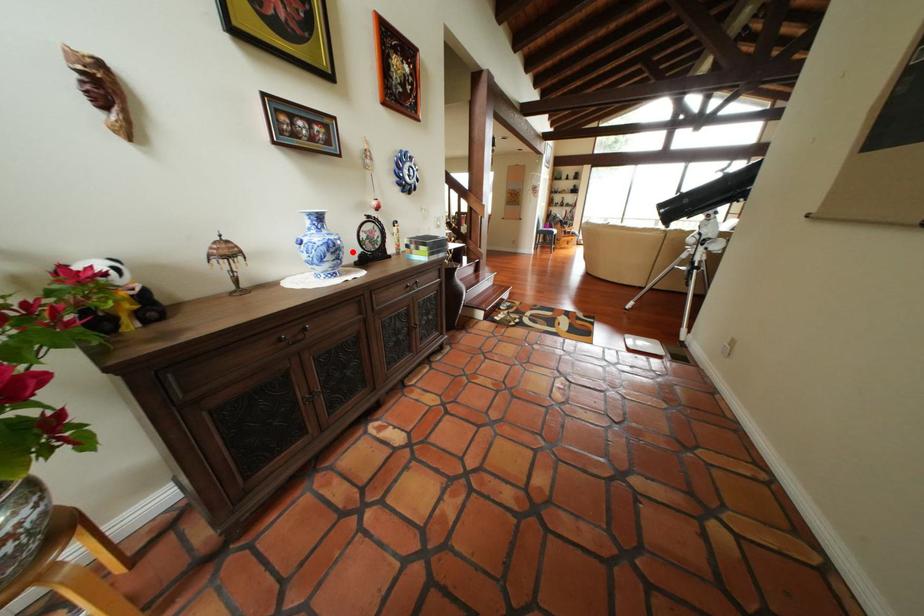
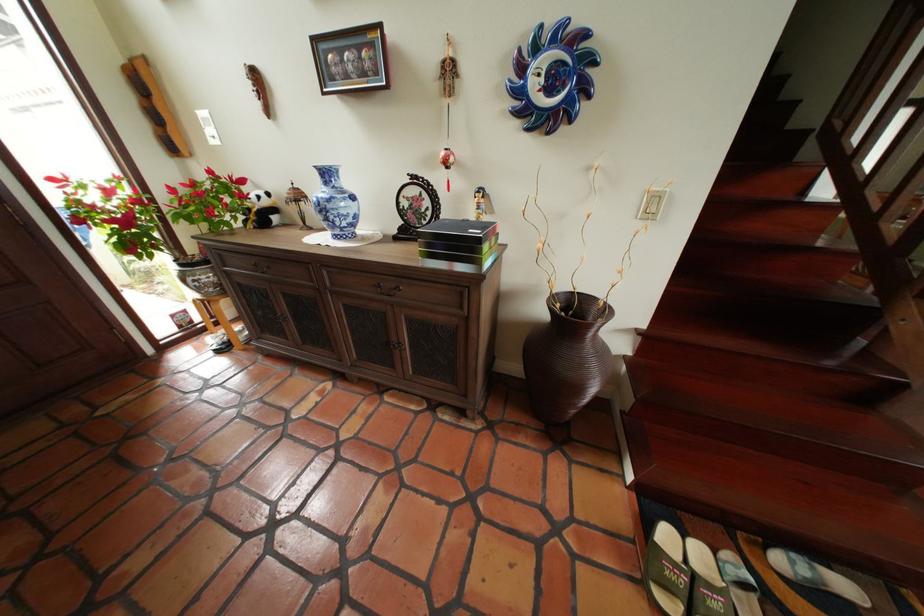
The point at the highlighted location is marked in the first image. Where is the corresponding point in the second image?

(341, 214)